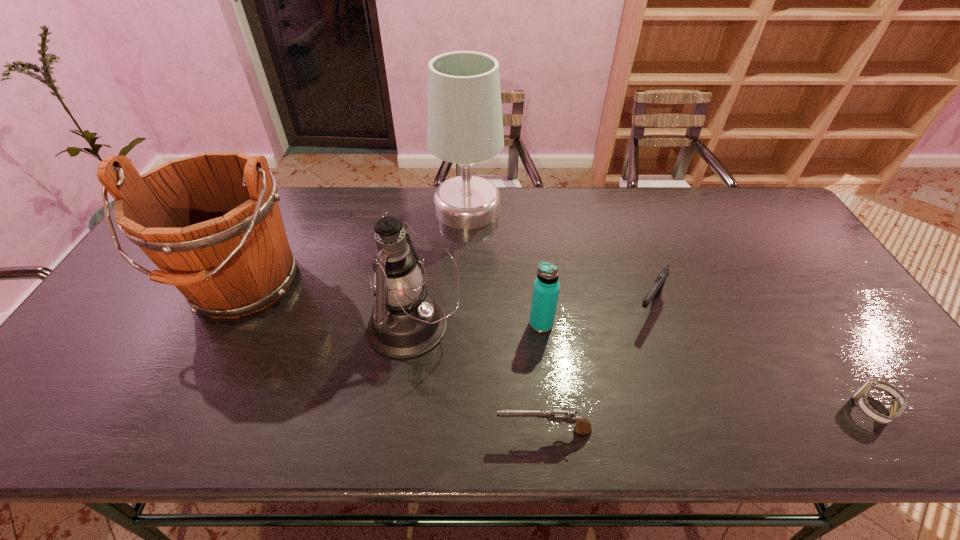
This screenshot has height=540, width=960. Identify the location of vacant space at the left edge of the desktop. (132, 327).

The width and height of the screenshot is (960, 540). I want to click on free space at the right edge of the desktop, so click(832, 363).

Identify the location of blank space at the near left corner of the desktop. (80, 440).

This screenshot has height=540, width=960. I want to click on free space between the tallest object and the second object from right to left, so click(x=558, y=258).

Locate an element on the screen. This screenshot has width=960, height=540. vacant space in between the rightmost object and the second object from right to left is located at coordinates (760, 357).

Where is `free space between the watch and the leftmost object`? The image size is (960, 540). free space between the watch and the leftmost object is located at coordinates (558, 347).

Image resolution: width=960 pixels, height=540 pixels. Find the location of `free area in between the oil lamp and the watch`. free area in between the oil lamp and the watch is located at coordinates (643, 367).

The height and width of the screenshot is (540, 960). In order to click on empty space that is in between the nearer gun and the oil lamp in this screenshot , I will do `click(478, 379)`.

I want to click on vacant space in between the fourth shortest object and the oil lamp, so click(477, 326).

Where is `unoccupied area between the fifth tallest object and the lampshade`? This screenshot has width=960, height=540. unoccupied area between the fifth tallest object and the lampshade is located at coordinates (558, 258).